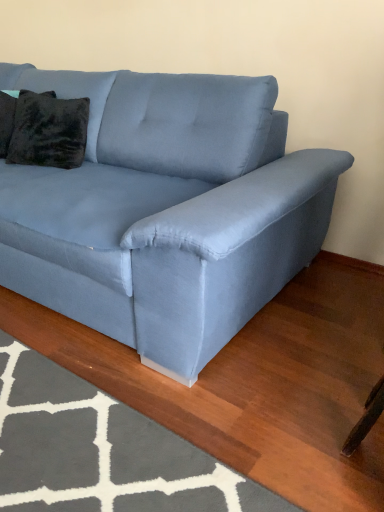
Question: Is the position of gray textured rug at lower left more distant than that of light blue fabric couch at center?

Choices:
 (A) no
 (B) yes

Answer: (A)

Question: From the image's perspective, would you say gray textured rug at lower left is shown under light blue fabric couch at center?

Choices:
 (A) yes
 (B) no

Answer: (A)

Question: Is gray textured rug at lower left facing away from light blue fabric couch at center?

Choices:
 (A) no
 (B) yes

Answer: (A)

Question: Considering the relative sizes of gray textured rug at lower left and light blue fabric couch at center in the image provided, is gray textured rug at lower left smaller than light blue fabric couch at center?

Choices:
 (A) yes
 (B) no

Answer: (A)

Question: Considering the relative sizes of gray textured rug at lower left and light blue fabric couch at center in the image provided, is gray textured rug at lower left thinner than light blue fabric couch at center?

Choices:
 (A) no
 (B) yes

Answer: (A)

Question: Could light blue fabric couch at center be considered to be inside gray textured rug at lower left?

Choices:
 (A) yes
 (B) no

Answer: (B)

Question: Could you tell me if velvety black pillow at upper left, placed as the 1th pillow when sorted from left to right, is facing velvet dark brown pillow at upper left, which is counted as the 2th pillow, starting from the left?

Choices:
 (A) no
 (B) yes

Answer: (A)

Question: Is velvety black pillow at upper left, placed as the 1th pillow when sorted from left to right, behind velvet dark brown pillow at upper left, the 1th pillow when ordered from right to left?

Choices:
 (A) yes
 (B) no

Answer: (A)

Question: Is velvety black pillow at upper left, placed as the 1th pillow when sorted from left to right, to the right of velvet dark brown pillow at upper left, which is counted as the 2th pillow, starting from the left, from the viewer's perspective?

Choices:
 (A) yes
 (B) no

Answer: (B)

Question: Can you confirm if velvety black pillow at upper left, placed as the 1th pillow when sorted from left to right, is positioned to the left of velvet dark brown pillow at upper left, the 1th pillow when ordered from right to left?

Choices:
 (A) yes
 (B) no

Answer: (A)

Question: Is velvety black pillow at upper left, which is the second pillow from right to left, positioned beyond the bounds of velvet dark brown pillow at upper left, the 1th pillow when ordered from right to left?

Choices:
 (A) yes
 (B) no

Answer: (A)

Question: Is the position of velvety black pillow at upper left, placed as the 1th pillow when sorted from left to right, less distant than that of velvet dark brown pillow at upper left, the 1th pillow when ordered from right to left?

Choices:
 (A) no
 (B) yes

Answer: (A)

Question: Are gray textured rug at lower left and velvet dark brown pillow at upper left, the 1th pillow when ordered from right to left, far apart?

Choices:
 (A) no
 (B) yes

Answer: (B)